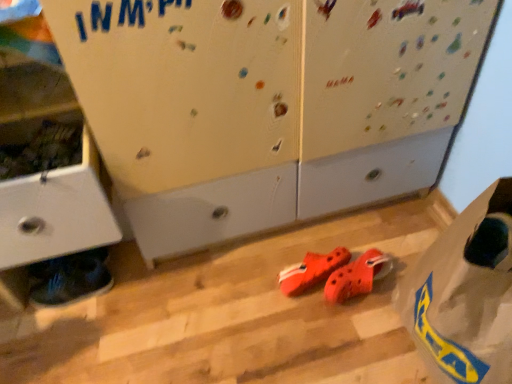
Identify the location of free space to the left of orange rubber clogs at center, the 3th footwear in the left-to-right sequence. The width and height of the screenshot is (512, 384). (283, 297).